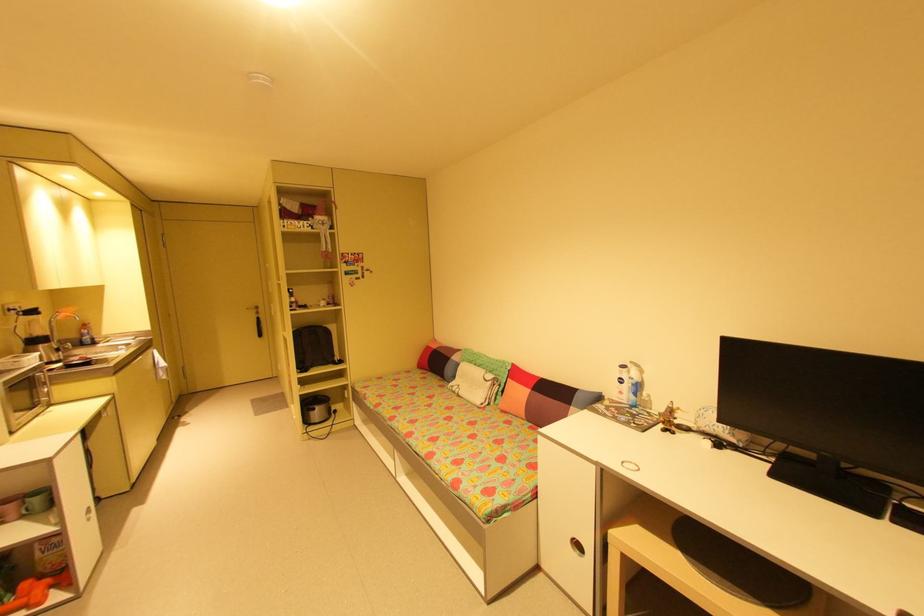
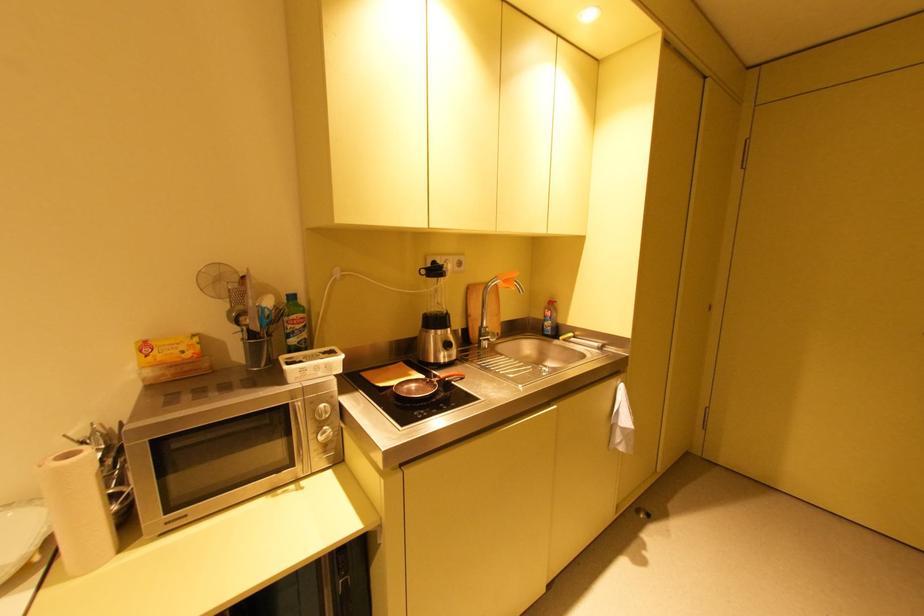
Locate, in the second image, the point that corresponds to point (52, 345) in the first image.

(444, 331)